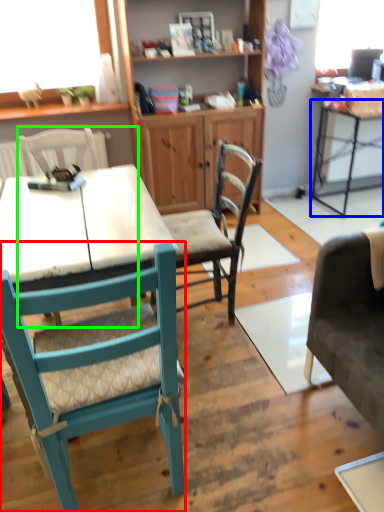
Question: Which object is the closest to the chair (highlighted by a red box)? Choose among these: table (highlighted by a blue box) or chair (highlighted by a green box).

Choices:
 (A) table
 (B) chair

Answer: (B)